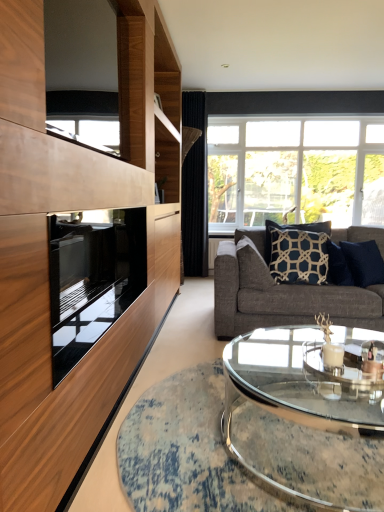
Describe the element at coordinates (298, 255) in the screenshot. Image resolution: width=384 pixels, height=512 pixels. I see `navy blue fabric pillow at center, marked as the 2th pillow in a left-to-right arrangement` at that location.

The image size is (384, 512). Identify the location of dark blue textured pillow at center right, the 1th pillow from the right. (364, 262).

Which is closer, (x=296, y=229) or (x=331, y=208)?

Positioned in front is point (x=296, y=229).

In the scene shown: Which object is thinner, navy blue fabric pillow at center, which ranks as the 2th pillow in right-to-left order, or clear glass window at upper right?

navy blue fabric pillow at center, which ranks as the 2th pillow in right-to-left order, is thinner.

Can we say navy blue fabric pillow at center, marked as the 2th pillow in a left-to-right arrangement, lies outside clear glass window at upper right?

Yes.

Is navy blue fabric pillow at center, which ranks as the 2th pillow in right-to-left order, oriented away from clear glass window at upper right?

Yes, navy blue fabric pillow at center, which ranks as the 2th pillow in right-to-left order, is positioned with its back facing clear glass window at upper right.

Is navy blue fabric pillow at center, which ranks as the 2th pillow in right-to-left order, oriented towards dark blue textured pillow at center, which is the 3th pillow in right-to-left order?

No, navy blue fabric pillow at center, which ranks as the 2th pillow in right-to-left order, is not turned towards dark blue textured pillow at center, which is the 3th pillow in right-to-left order.

What's the angular difference between navy blue fabric pillow at center, which ranks as the 2th pillow in right-to-left order, and dark blue textured pillow at center, which is the 3th pillow in right-to-left order,'s facing directions?

navy blue fabric pillow at center, which ranks as the 2th pillow in right-to-left order, and dark blue textured pillow at center, which is the 3th pillow in right-to-left order, are facing 90 degrees away from each other.

Is dark blue textured pillow at center, the 1th pillow from the left, surrounded by navy blue fabric pillow at center, marked as the 2th pillow in a left-to-right arrangement?

No, dark blue textured pillow at center, the 1th pillow from the left, is located outside of navy blue fabric pillow at center, marked as the 2th pillow in a left-to-right arrangement.

Can you confirm if navy blue fabric pillow at center, which ranks as the 2th pillow in right-to-left order, is bigger than dark blue textured pillow at center, which is the 3th pillow in right-to-left order?

Yes, navy blue fabric pillow at center, which ranks as the 2th pillow in right-to-left order, is bigger than dark blue textured pillow at center, which is the 3th pillow in right-to-left order.

Would you say clear glass window at upper right is inside or outside dark blue textured pillow at center right, arranged as the 3th pillow when viewed from the left?

clear glass window at upper right is located beyond the bounds of dark blue textured pillow at center right, arranged as the 3th pillow when viewed from the left.

Which of these two, clear glass window at upper right or dark blue textured pillow at center right, arranged as the 3th pillow when viewed from the left, stands taller?

clear glass window at upper right.

How different are the orientations of clear glass window at upper right and dark blue textured pillow at center right, the 1th pillow from the right, in degrees?

They differ by 38.6 degrees in their facing directions.

Which of these two, black glass oven at left or navy blue fabric pillow at center, which ranks as the 2th pillow in right-to-left order, is bigger?

black glass oven at left.

Choose the correct answer: Is black glass oven at left inside navy blue fabric pillow at center, marked as the 2th pillow in a left-to-right arrangement, or outside it?

black glass oven at left is outside navy blue fabric pillow at center, marked as the 2th pillow in a left-to-right arrangement.

Which is more to the right, black glass oven at left or navy blue fabric pillow at center, which ranks as the 2th pillow in right-to-left order?

From the viewer's perspective, navy blue fabric pillow at center, which ranks as the 2th pillow in right-to-left order, appears more on the right side.

Which of these two, black glass oven at left or navy blue fabric pillow at center, marked as the 2th pillow in a left-to-right arrangement, is wider?

Wider between the two is black glass oven at left.

From a real-world perspective, relative to navy blue fabric pillow at center, marked as the 2th pillow in a left-to-right arrangement, is black velvet curtain at center vertically above or below?

black velvet curtain at center is above navy blue fabric pillow at center, marked as the 2th pillow in a left-to-right arrangement.

Looking at this image, can you tell me how much black velvet curtain at center and navy blue fabric pillow at center, marked as the 2th pillow in a left-to-right arrangement, differ in facing direction?

They differ by 0.147 degrees in their facing directions.

Is the depth of black velvet curtain at center less than that of navy blue fabric pillow at center, marked as the 2th pillow in a left-to-right arrangement?

No, black velvet curtain at center is further to the viewer.

Is dark blue textured pillow at center, the 1th pillow from the left, not near black glass oven at left?

Yes, dark blue textured pillow at center, the 1th pillow from the left, and black glass oven at left are located far from each other.

Considering the sizes of objects dark blue textured pillow at center, which is the 3th pillow in right-to-left order, and black glass oven at left in the image provided, who is shorter, dark blue textured pillow at center, which is the 3th pillow in right-to-left order, or black glass oven at left?

Standing shorter between the two is dark blue textured pillow at center, which is the 3th pillow in right-to-left order.

Considering the positions of objects dark blue textured pillow at center, which is the 3th pillow in right-to-left order, and black glass oven at left in the image provided, who is in front, dark blue textured pillow at center, which is the 3th pillow in right-to-left order, or black glass oven at left?

black glass oven at left is in front.

Is dark blue textured pillow at center, which is the 3th pillow in right-to-left order, looking in the opposite direction of black glass oven at left?

No.

Can you confirm if dark blue textured pillow at center right, arranged as the 3th pillow when viewed from the left, is smaller than dark gray fabric couch at center?

Yes.

From the image's perspective, is dark blue textured pillow at center right, arranged as the 3th pillow when viewed from the left, above dark gray fabric couch at center?

Yes, from the image's perspective, dark blue textured pillow at center right, arranged as the 3th pillow when viewed from the left, is on top of dark gray fabric couch at center.

Considering the sizes of dark blue textured pillow at center right, the 1th pillow from the right, and dark gray fabric couch at center in the image, is dark blue textured pillow at center right, the 1th pillow from the right, wider or thinner than dark gray fabric couch at center?

dark blue textured pillow at center right, the 1th pillow from the right, is thinner than dark gray fabric couch at center.

You are a GUI agent. You are given a task and a screenshot of the screen. Output one action in this format:
    pyautogui.click(x=<x>, y=<y>)
    Task: Click on the pillow that is the 1st object located below the clear glass window at upper right (from the image's perspective)
    The image size is (384, 512).
    Given the screenshot: What is the action you would take?
    pyautogui.click(x=298, y=255)

Image resolution: width=384 pixels, height=512 pixels. What are the coordinates of `pillow lying above the dark blue textured pillow at center, which is the 3th pillow in right-to-left order (from the image's perspective)` in the screenshot? It's located at (298, 255).

Consider the image. Which object lies nearer to the anchor point clear glass coffee table at center, dark gray fabric couch at center or black glass oven at left?

Based on the image, dark gray fabric couch at center appears to be nearer to clear glass coffee table at center.

Looking at the image, which one is located closer to dark gray fabric couch at center, dark blue textured pillow at center, the 1th pillow from the left, or dark blue textured pillow at center right, arranged as the 3th pillow when viewed from the left?

The object closer to dark gray fabric couch at center is dark blue textured pillow at center, the 1th pillow from the left.

Estimate the real-world distances between objects in this image. Which object is closer to black glass oven at left, clear glass window at upper right or dark gray fabric couch at center?

dark gray fabric couch at center.

In the scene shown: Considering their positions, is clear glass coffee table at center positioned further to black velvet curtain at center than dark blue textured pillow at center right, the 1th pillow from the right?

The object further to black velvet curtain at center is clear glass coffee table at center.

From the image, which object appears to be nearer to clear glass window at upper right, dark blue textured pillow at center right, the 1th pillow from the right, or dark gray fabric couch at center?

Among the two, dark gray fabric couch at center is located nearer to clear glass window at upper right.

Estimate the real-world distances between objects in this image. Which object is closer to dark blue textured pillow at center right, the 1th pillow from the right, black glass oven at left or clear glass window at upper right?

Based on the image, black glass oven at left appears to be nearer to dark blue textured pillow at center right, the 1th pillow from the right.

Based on their spatial positions, is dark blue textured pillow at center, the 1th pillow from the left, or dark blue textured pillow at center right, arranged as the 3th pillow when viewed from the left, further from black velvet curtain at center?

Based on the image, dark blue textured pillow at center, the 1th pillow from the left, appears to be further to black velvet curtain at center.

When comparing their distances from dark gray fabric couch at center, does clear glass window at upper right or dark blue textured pillow at center right, arranged as the 3th pillow when viewed from the left, seem closer?

dark blue textured pillow at center right, arranged as the 3th pillow when viewed from the left, lies closer to dark gray fabric couch at center than the other object.

Locate an element on the screen. curtain between clear glass coffee table at center and clear glass window at upper right from front to back is located at coordinates [x=195, y=189].

Where is `studio couch between black glass oven at left and dark blue textured pillow at center right, the 1th pillow from the right, in the front-back direction`? Image resolution: width=384 pixels, height=512 pixels. studio couch between black glass oven at left and dark blue textured pillow at center right, the 1th pillow from the right, in the front-back direction is located at coordinates (282, 296).

At what (x,y) coordinates should I click in order to perform the action: click on pillow situated between dark blue textured pillow at center, which is the 3th pillow in right-to-left order, and dark blue textured pillow at center right, arranged as the 3th pillow when viewed from the left, from left to right. Please return your answer as a coordinate pair (x, y). Looking at the image, I should click on (298, 255).

Where is `pillow positioned between dark blue textured pillow at center right, the 1th pillow from the right, and black velvet curtain at center from near to far`? The height and width of the screenshot is (512, 384). pillow positioned between dark blue textured pillow at center right, the 1th pillow from the right, and black velvet curtain at center from near to far is located at coordinates (298, 255).